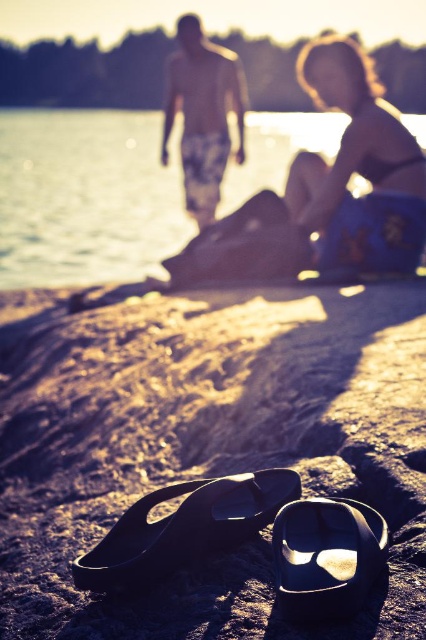
Where is `black rubber sandals at lower center`? This screenshot has height=640, width=426. black rubber sandals at lower center is located at coordinates (184, 528).

How far apart are black rubber sandals at lower center and black rubber flip-flop at lower center?

6.57 inches

I want to click on black rubber sandals at lower center, so click(x=184, y=528).

Does blue fabric bikini top at upper right have a lesser height compared to matte floral shorts at upper center?

Yes.

The height and width of the screenshot is (640, 426). Describe the element at coordinates (359, 168) in the screenshot. I see `blue fabric bikini top at upper right` at that location.

The height and width of the screenshot is (640, 426). I want to click on blue fabric bikini top at upper right, so click(x=359, y=168).

Between point (351, 260) and point (354, 588), which one is positioned in front?

Point (354, 588) is in front.

Identify the location of blue fabric bikini top at upper right. The image size is (426, 640). (359, 168).

Which is in front, point (420, 189) or point (279, 524)?

Positioned in front is point (279, 524).

Locate an element on the screen. blue fabric bikini top at upper right is located at coordinates (359, 168).